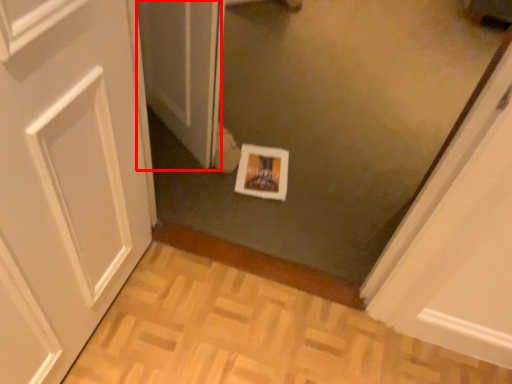
Question: From the image's perspective, where is screen door (annotated by the red box) located in relation to print in the image?

Choices:
 (A) below
 (B) above

Answer: (B)